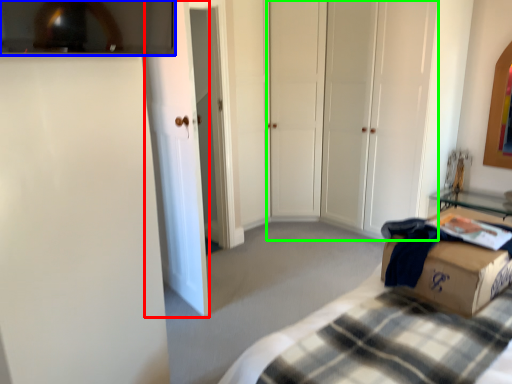
Question: Which object is positioned closest to glass door (highlighted by a red box)? Select from glass window (highlighted by a blue box) and glass door (highlighted by a green box).

Choices:
 (A) glass window
 (B) glass door

Answer: (A)